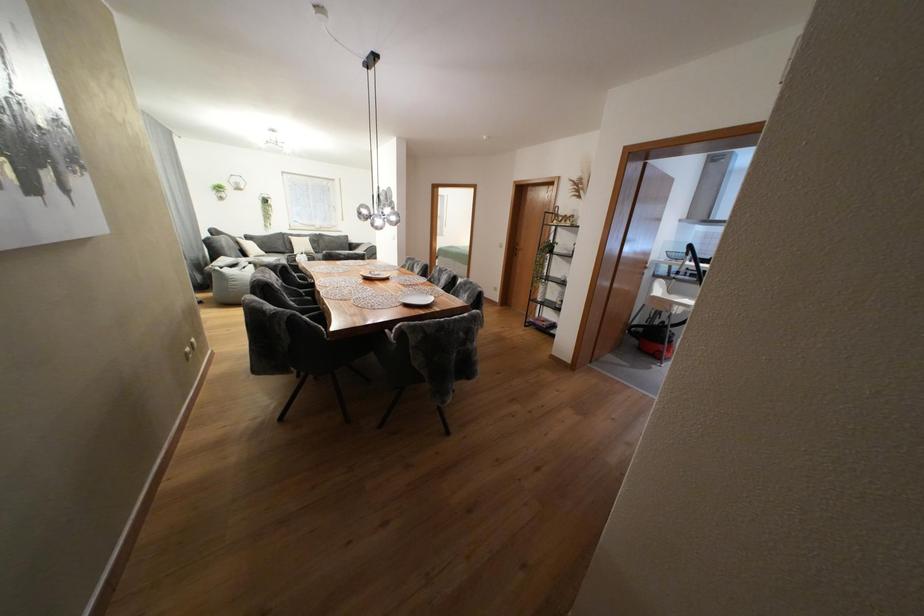
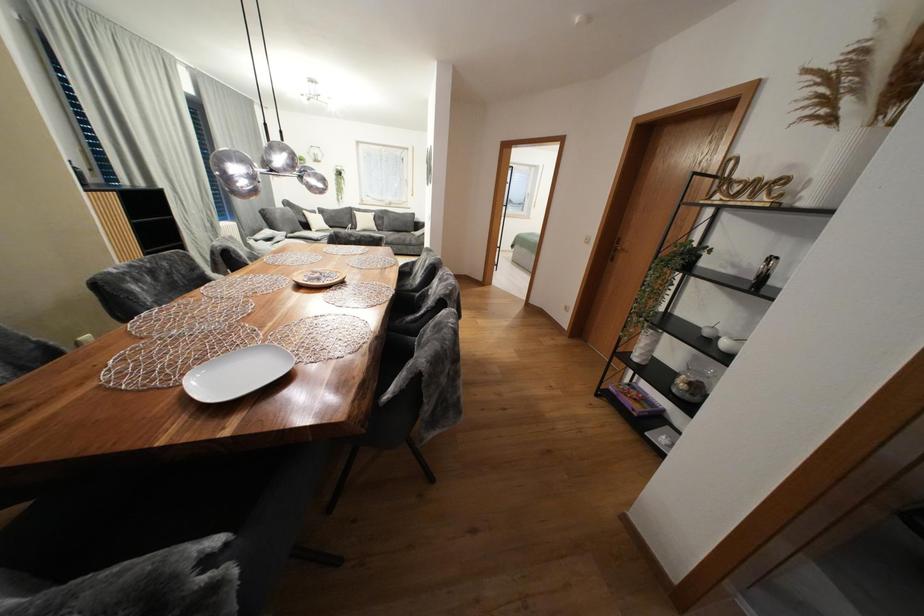
Which direction would the cameraman need to move to produce the second image?

The cameraman walked toward right, forward.